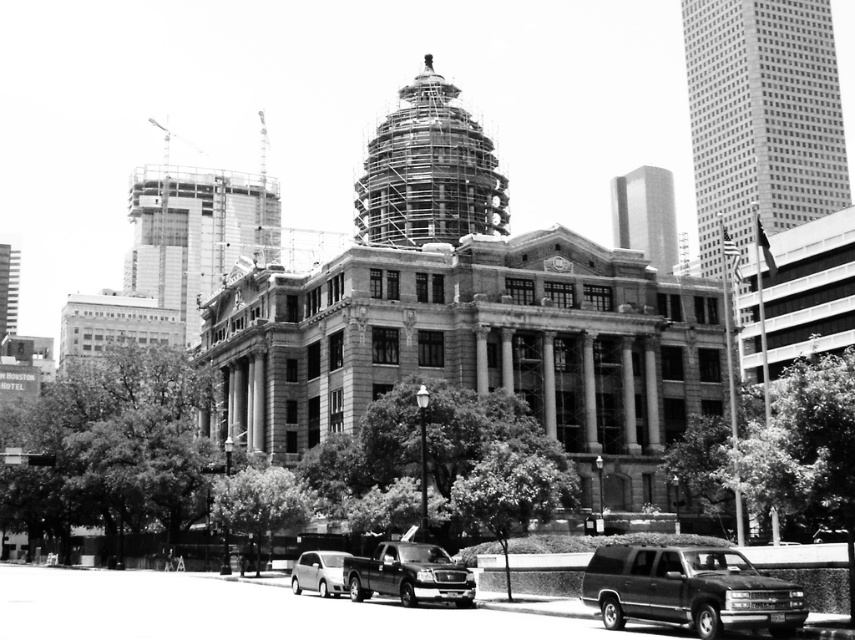
Does point (759, 593) come closer to viewer compared to point (384, 582)?

That is True.

Does shiny black suv at lower right appear on the right side of shiny black truck at lower center?

Correct, you'll find shiny black suv at lower right to the right of shiny black truck at lower center.

Does point (794, 595) come farther from viewer compared to point (460, 593)?

No, (794, 595) is in front of (460, 593).

I want to click on shiny black suv at lower right, so click(688, 589).

Is point (643, 548) farther from camera compared to point (314, 563)?

That is False.

In the scene shown: Is shiny black suv at lower right above silver metallic hatchback at lower left?

Yes.

Between point (624, 561) and point (310, 579), which one is positioned in front?

Point (624, 561) is more forward.

The image size is (855, 640). I want to click on shiny black suv at lower right, so click(x=688, y=589).

Between shiny black truck at lower center and silver metallic hatchback at lower left, which one appears on the right side from the viewer's perspective?

shiny black truck at lower center

Is point (404, 602) positioned behind point (310, 560)?

No, it is in front of (310, 560).

Locate an element on the screen. shiny black truck at lower center is located at coordinates (408, 573).